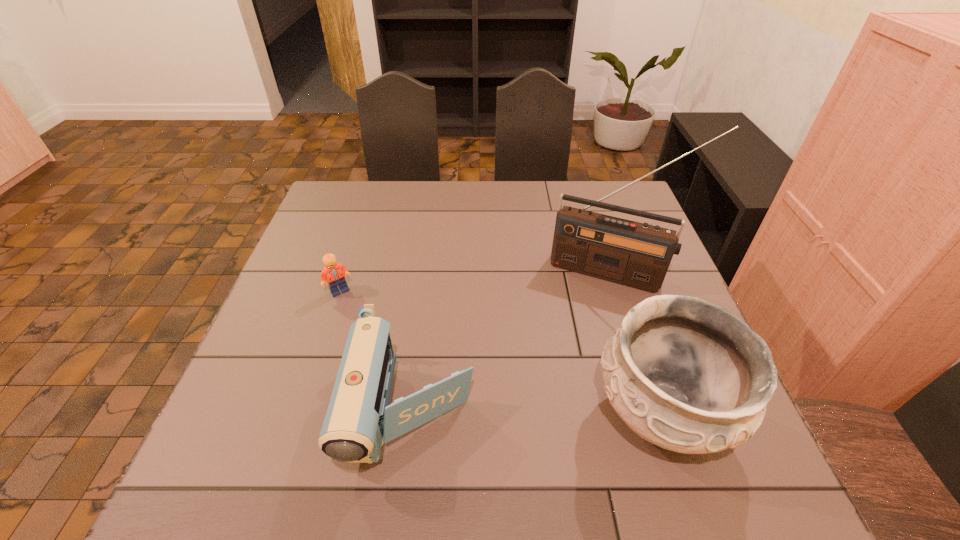
The image size is (960, 540). In the image, there is a desktop. What are the coordinates of `free space at the near edge` in the screenshot? It's located at (457, 435).

In the image, there is a desktop. What are the coordinates of `vacant space at the left edge` in the screenshot? It's located at (328, 337).

The width and height of the screenshot is (960, 540). I want to click on vacant region at the far left corner of the desktop, so click(324, 207).

At what (x,y) coordinates should I click in order to perform the action: click on free space between the third object from right to left and the radio receiver. Please return your answer as a coordinate pair (x, y). The width and height of the screenshot is (960, 540). Looking at the image, I should click on (512, 342).

Identify the location of free space between the leftmost object and the third shortest object. The height and width of the screenshot is (540, 960). (500, 352).

In order to click on vacant area that lies between the pottery and the Lego in this screenshot , I will do `click(500, 352)`.

Locate an element on the screen. The width and height of the screenshot is (960, 540). empty space that is in between the pottery and the shortest object is located at coordinates 500,352.

This screenshot has width=960, height=540. I want to click on unoccupied position between the third object from right to left and the radio receiver, so click(x=512, y=342).

Find the location of a particular element. vacant area that lies between the second shortest object and the radio receiver is located at coordinates (512, 342).

Identify which object is the third nearest to the pottery. Please provide its 2D coordinates. Your answer should be formatted as a tuple, i.e. [(x, y)], where the tuple contains the x and y coordinates of a point satisfying the conditions above.

[(335, 273)]